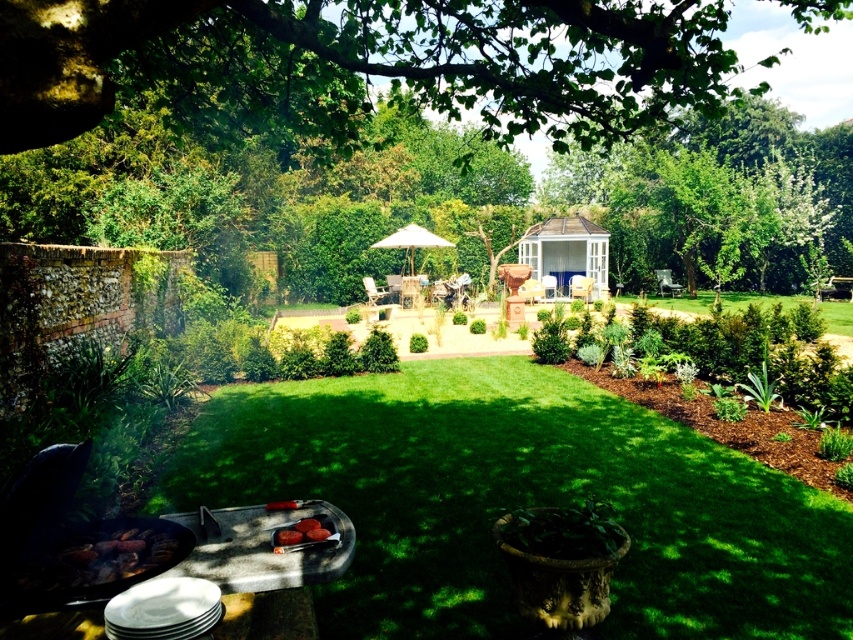
You are a gardener who wants to place a new plant between the charcoal briquettes at lower left and the smooth red tomato at lower center. The plant requires a minimum of 24 inches of space between them. Can you fit the plant between them?

The distance between the charcoal briquettes at lower left and the smooth red tomato at lower center is 25.18 inches, which is more than the required 24 inches. Yes, you can fit the plant between them.

You are planning to place a decorative item on the table in the garden. The table can only hold items narrower than the smooth red tomato at lower center. Can the white fabric umbrella at center fit on the table?

The white fabric umbrella at center is wider than the smooth red tomato at lower center, so it cannot fit on the table since its width exceeds the maximum allowed width.